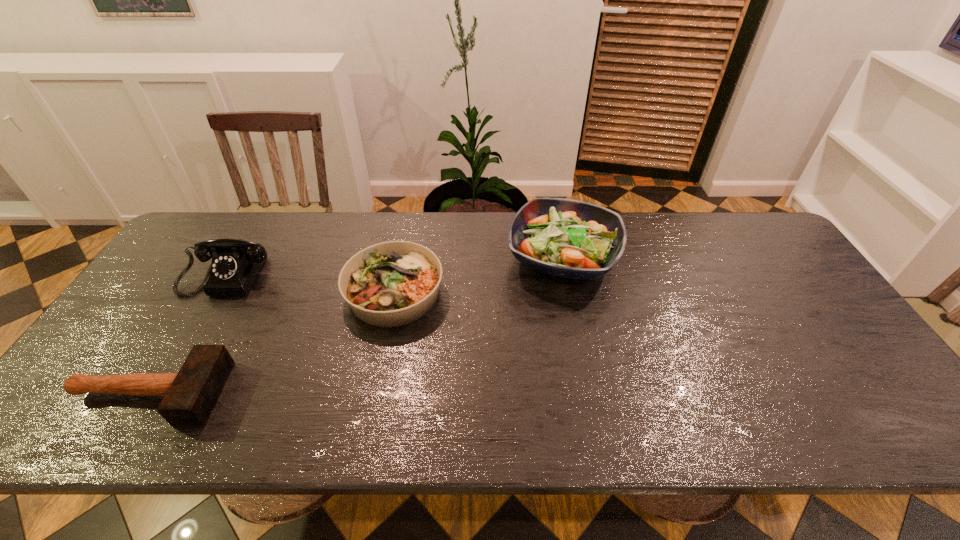
This screenshot has width=960, height=540. I want to click on vacant space at the right edge of the desktop, so click(790, 338).

The image size is (960, 540). In the image, there is a desktop. What are the coordinates of `free space at the far left corner` in the screenshot? It's located at (184, 243).

This screenshot has width=960, height=540. What are the coordinates of `vacant space at the far right corner of the desktop` in the screenshot? It's located at (725, 212).

Image resolution: width=960 pixels, height=540 pixels. Identify the location of vacant point located between the second object from right to left and the right salad plate. (479, 275).

Locate an element on the screen. vacant area that lies between the shortest object and the third object from left to right is located at coordinates (272, 343).

Where is `unoccupied area between the shorter salad plate and the taller salad plate`? unoccupied area between the shorter salad plate and the taller salad plate is located at coordinates (479, 275).

This screenshot has width=960, height=540. I want to click on free spot between the mallet and the shorter salad plate, so click(x=272, y=343).

The width and height of the screenshot is (960, 540). Identify the location of free point between the shorter salad plate and the shortest object. (x=272, y=343).

The image size is (960, 540). Identify the location of blank region between the left salad plate and the taller salad plate. (479, 275).

The width and height of the screenshot is (960, 540). Find the location of `free space that is in between the left salad plate and the telephone`. free space that is in between the left salad plate and the telephone is located at coordinates (313, 282).